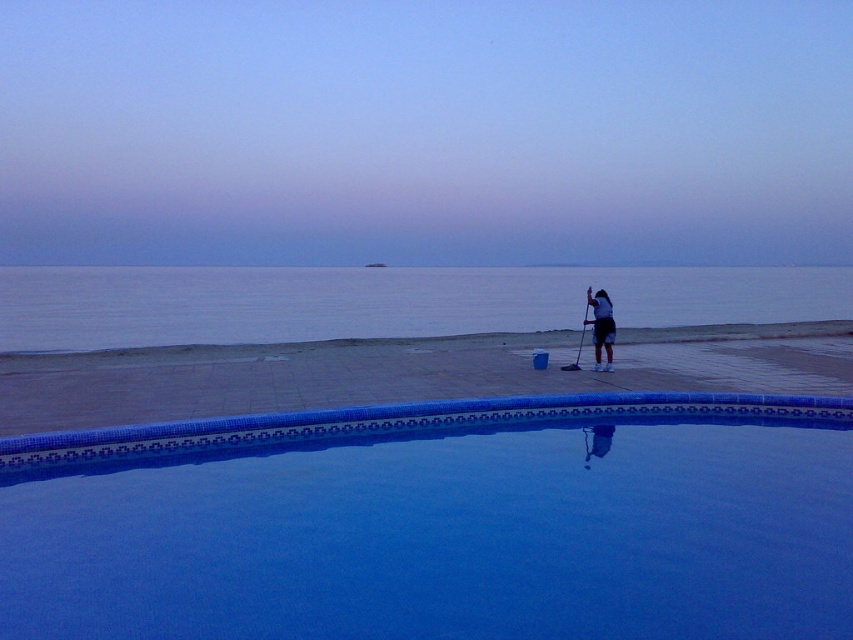
Is blue smooth water at center positioned at the back of dark blue fabric shorts at right?

No, it is in front of dark blue fabric shorts at right.

Where is `blue smooth water at center`? blue smooth water at center is located at coordinates (384, 301).

At what (x,y) coordinates should I click in order to perform the action: click on blue smooth water at center. Please return your answer as a coordinate pair (x, y). This screenshot has width=853, height=640. Looking at the image, I should click on (384, 301).

Is point (325, 420) in front of point (659, 387)?

Yes, point (325, 420) is in front of point (659, 387).

From the picture: Can you confirm if blue glossy pool at center is bigger than smooth concrete beach at center?

No, blue glossy pool at center is not bigger than smooth concrete beach at center.

Is point (221, 522) positioned behind point (100, 362)?

That is False.

Where is `blue glossy pool at center`? blue glossy pool at center is located at coordinates (439, 522).

Is blue smooth water at center above smooth concrete beach at center?

Indeed, blue smooth water at center is positioned over smooth concrete beach at center.

Can you confirm if blue smooth water at center is wider than smooth concrete beach at center?

Yes.

Based on the photo, measure the distance between blue smooth water at center and camera.

They are 14.35 meters apart.

Where is `blue smooth water at center`? Image resolution: width=853 pixels, height=640 pixels. blue smooth water at center is located at coordinates (384, 301).